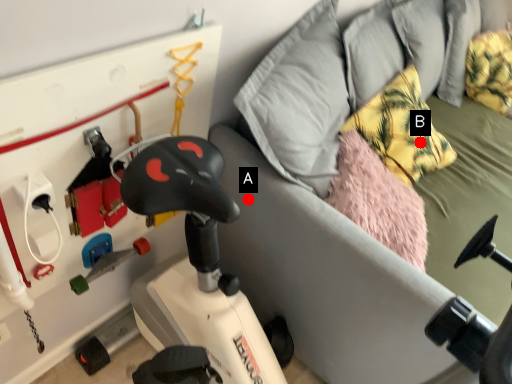
Question: Two points are circled on the image, labeled by A and B beside each circle. Which point is farther to the camera?

Choices:
 (A) A is further
 (B) B is further

Answer: (B)